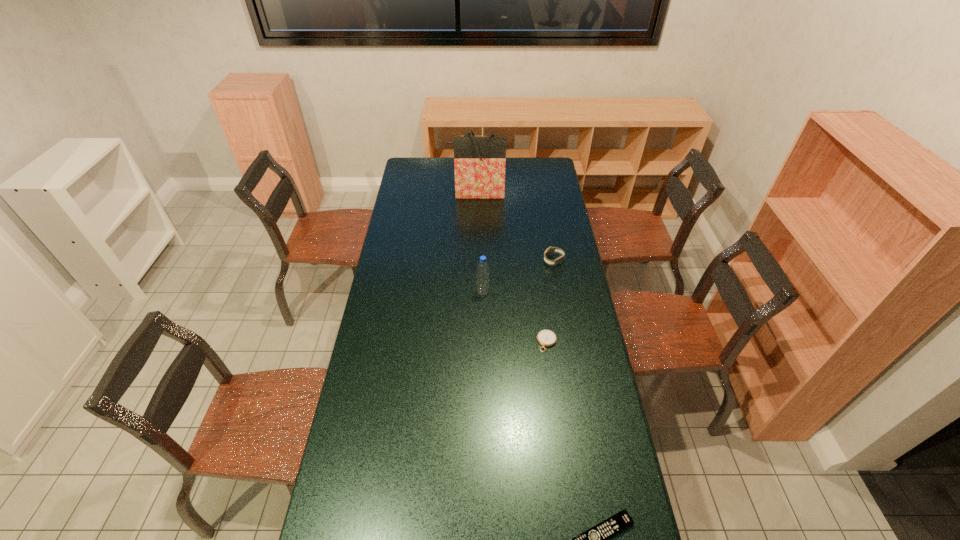
I want to click on free spot between the compass and the tallest object, so click(512, 267).

The height and width of the screenshot is (540, 960). What are the coordinates of `blank region between the shopping bag and the second nearest object` in the screenshot? It's located at (512, 267).

Find the location of a particular element. The width and height of the screenshot is (960, 540). free space between the watch and the shopping bag is located at coordinates (516, 227).

The height and width of the screenshot is (540, 960). I want to click on vacant space that is in between the water bottle and the watch, so pyautogui.click(x=518, y=276).

The height and width of the screenshot is (540, 960). Identify the location of empty space that is in between the second tallest object and the tallest object. [x=480, y=242].

Where is `free space between the compass and the fourth nearest object`? free space between the compass and the fourth nearest object is located at coordinates (550, 301).

Image resolution: width=960 pixels, height=540 pixels. In order to click on the fourth closest object to the watch in this screenshot , I will do (596, 539).

Locate an element on the screen. object that can be found as the second closest to the third nearest object is located at coordinates (549, 251).

Where is `vacant space that satisfies the following two spatial constraints: 1. on the face of the watch; 2. on the front side of the compass`? This screenshot has width=960, height=540. vacant space that satisfies the following two spatial constraints: 1. on the face of the watch; 2. on the front side of the compass is located at coordinates (567, 342).

Find the location of a particular element. This screenshot has width=960, height=540. vacant area that satisfies the following two spatial constraints: 1. on the front side of the fourth farthest object; 2. on the left side of the farthest object is located at coordinates (475, 342).